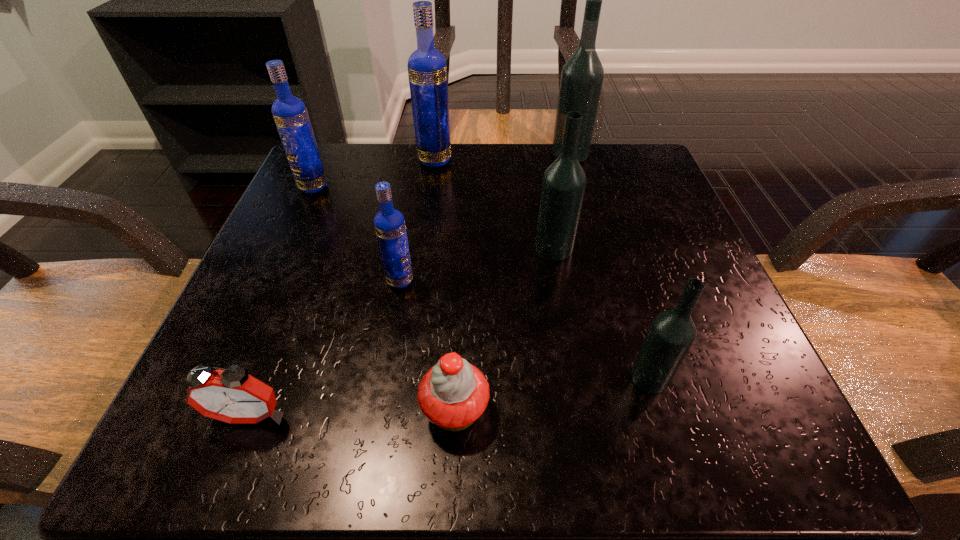
At what (x,y) coordinates should I click in order to perform the action: click on alarm clock. Please return your answer as a coordinate pair (x, y). This screenshot has height=540, width=960. Looking at the image, I should click on (231, 395).

Identify the location of red cupcake. The width and height of the screenshot is (960, 540). (453, 394).

The image size is (960, 540). What are the coordinates of `vacant space located on the right of the biggest blue vodka` in the screenshot? It's located at (516, 160).

The height and width of the screenshot is (540, 960). I want to click on free space located on the left of the biggest black vodka, so click(516, 153).

Where is `free region located on the front of the second nearest blue vodka`? The width and height of the screenshot is (960, 540). free region located on the front of the second nearest blue vodka is located at coordinates (271, 281).

At what (x,y) coordinates should I click in order to perform the action: click on free location located 0.270m on the back of the fourth farthest object. Please return your answer as a coordinate pair (x, y). Looking at the image, I should click on (538, 155).

In order to click on free location located 0.210m on the front of the smallest blue vodka in this screenshot , I will do `click(376, 417)`.

Where is `free space located on the back of the nearest black vodka`? free space located on the back of the nearest black vodka is located at coordinates (606, 233).

Find the location of a particular element. free region located 0.170m on the right of the cupcake is located at coordinates 626,410.

I want to click on vodka present at the near edge, so click(671, 334).